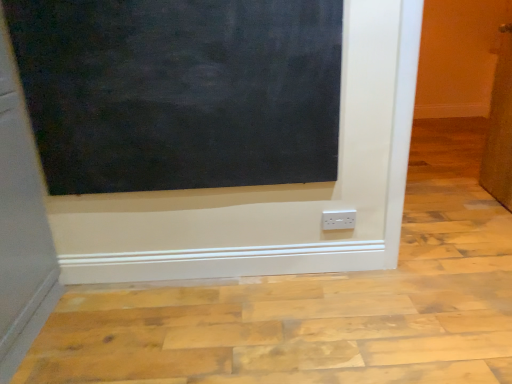
At what (x,y) coordinates should I click in order to perform the action: click on free spot in front of brown textured door at right. Please return your answer as a coordinate pair (x, y). This screenshot has height=384, width=512. Looking at the image, I should click on (486, 224).